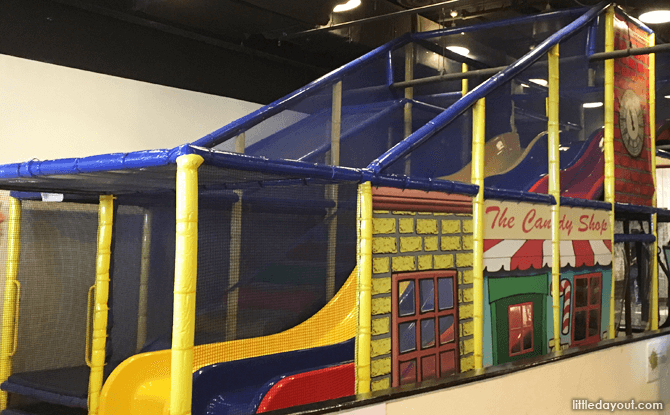
Find the location of a particular element. wall is located at coordinates (110, 126).